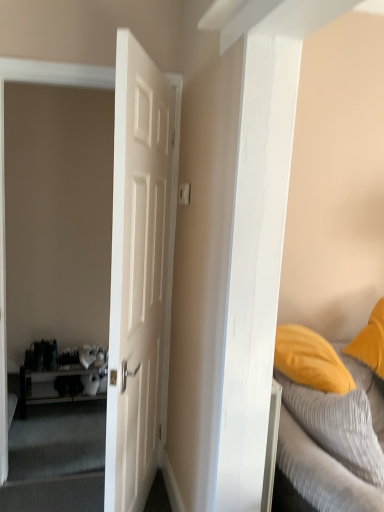
Question: In terms of height, does textured gray bed at right look taller or shorter compared to wooden shelf at left?

Choices:
 (A) tall
 (B) short

Answer: (A)

Question: From a real-world perspective, is textured gray bed at right positioned above or below wooden shelf at left?

Choices:
 (A) below
 (B) above

Answer: (B)

Question: Considering the real-world distances, which object is closest to the wooden shelf at left?

Choices:
 (A) textured gray bed at right
 (B) white matte door at center

Answer: (B)

Question: Which object is the farthest from the wooden shelf at left?

Choices:
 (A) white matte door at center
 (B) textured gray bed at right

Answer: (B)